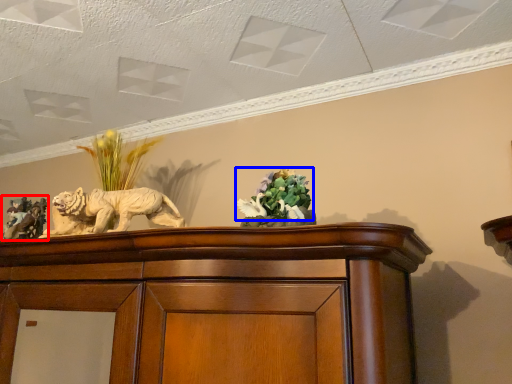
Question: Which object appears farthest to the camera in this image, sculpture (highlighted by a red box) or flower (highlighted by a blue box)?

Choices:
 (A) sculpture
 (B) flower

Answer: (A)